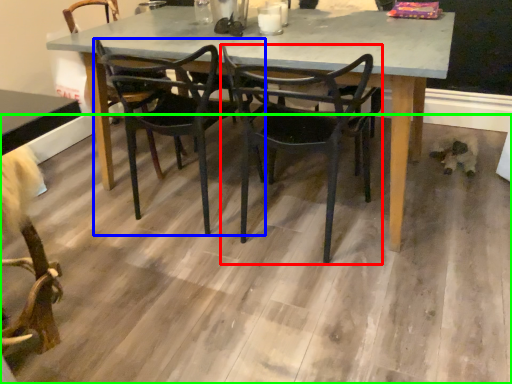
Question: Based on their relative distances, which object is nearer to chair (highlighted by a red box)? Choose from chair (highlighted by a blue box) and concrete (highlighted by a green box).

Choices:
 (A) chair
 (B) concrete

Answer: (A)